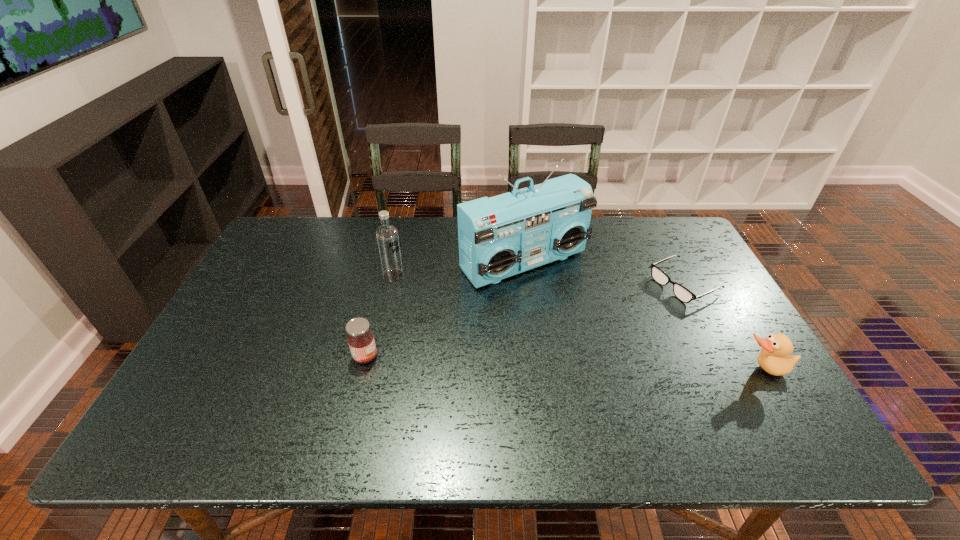
Where is `vacant space that satisfies the following two spatial constraints: 1. on the back side of the fourth shortest object; 2. on the right side of the third object from right to left`? vacant space that satisfies the following two spatial constraints: 1. on the back side of the fourth shortest object; 2. on the right side of the third object from right to left is located at coordinates (396, 262).

At what (x,y) coordinates should I click in order to perform the action: click on vacant point that satisfies the following two spatial constraints: 1. on the front side of the shortest object; 2. on the right side of the vodka. Please return your answer as a coordinate pair (x, y). The width and height of the screenshot is (960, 540). Looking at the image, I should click on (392, 284).

Locate an element on the screen. Image resolution: width=960 pixels, height=540 pixels. free spot that satisfies the following two spatial constraints: 1. on the front side of the radio receiver; 2. on the left side of the shortest object is located at coordinates (527, 284).